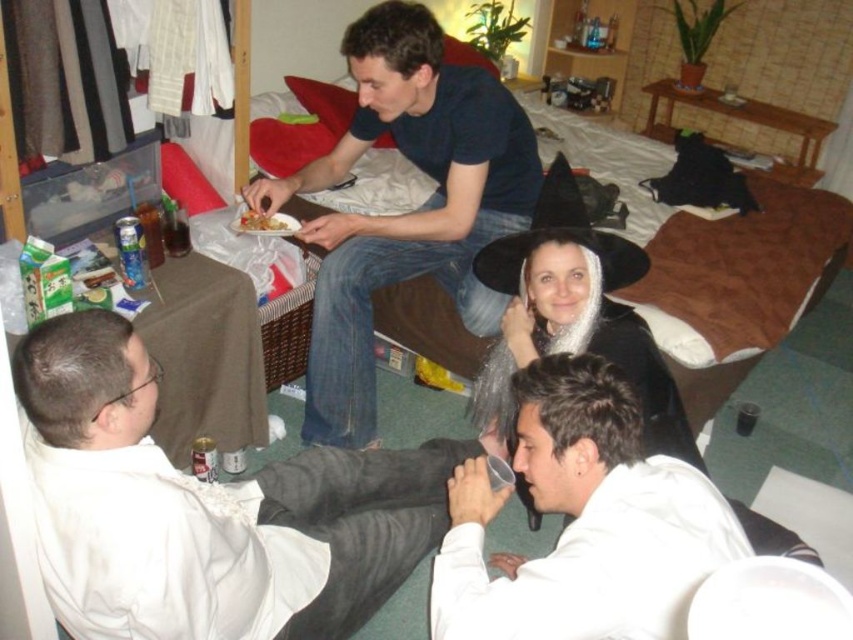
Question: Is white matte shirt at lower right below dark blue t-shirt at upper center?

Choices:
 (A) no
 (B) yes

Answer: (B)

Question: Which object is the farthest from the shiny metallic plate at center?

Choices:
 (A) dark blue t-shirt at upper center
 (B) white matte shirt at lower left
 (C) white matte shirt at lower right

Answer: (C)

Question: Does white matte shirt at lower left appear on the right side of dark blue t-shirt at upper center?

Choices:
 (A) yes
 (B) no

Answer: (B)

Question: Can you confirm if white matte shirt at lower left is positioned to the right of dark blue t-shirt at upper center?

Choices:
 (A) no
 (B) yes

Answer: (A)

Question: Which point is farther to the camera?

Choices:
 (A) (225, 586)
 (B) (392, 68)
 (C) (242, 216)

Answer: (C)

Question: Which of the following is the farthest from the observer?

Choices:
 (A) white matte shirt at lower right
 (B) dark blue t-shirt at upper center

Answer: (B)